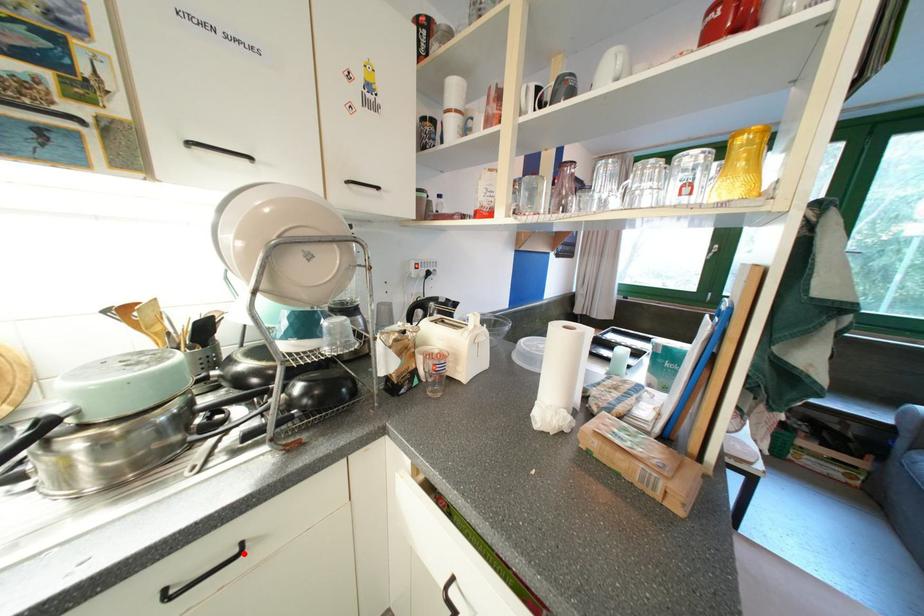
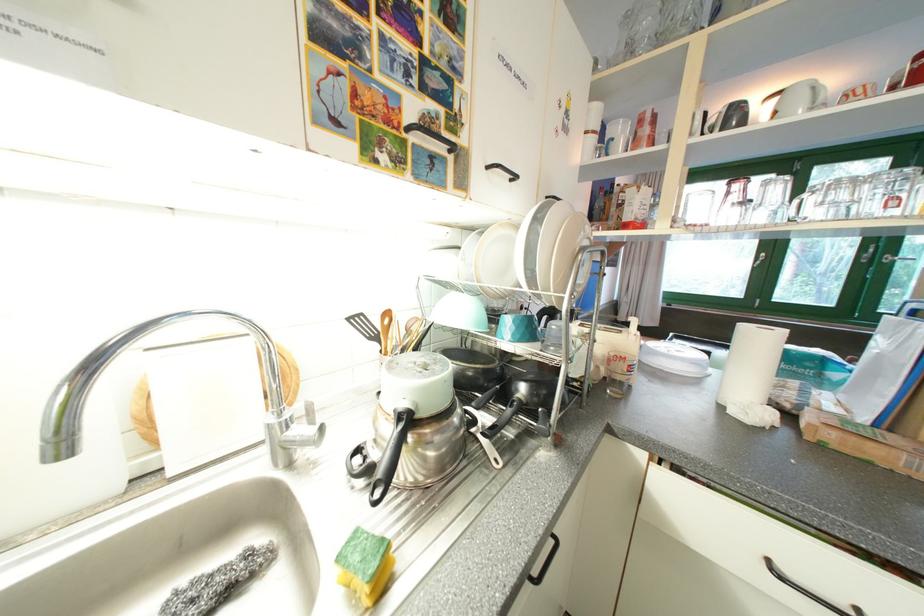
Where in the second image is the point corresponding to the highlighted location from the first image?

(560, 541)